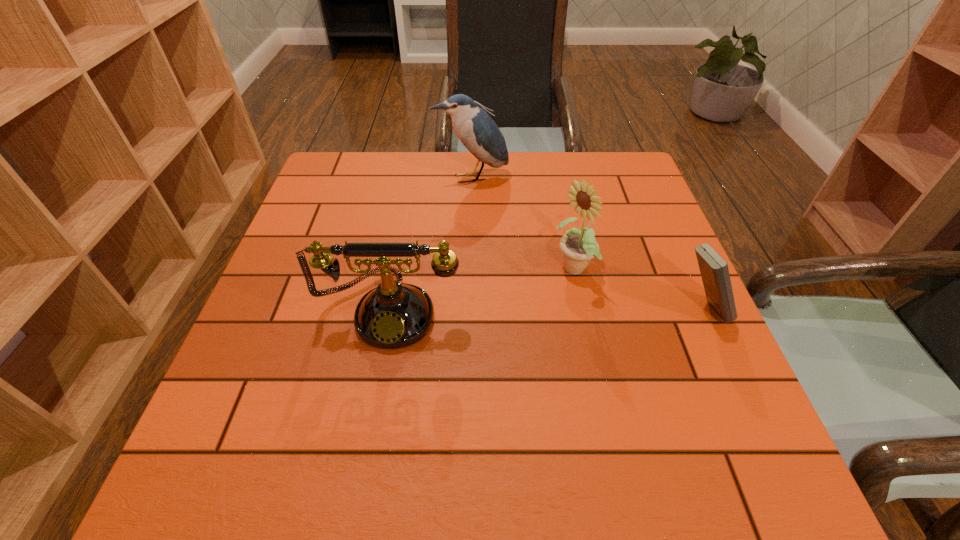
Image resolution: width=960 pixels, height=540 pixels. In order to click on free spot at the near right corner of the desktop in this screenshot , I will do `click(678, 417)`.

Where is `free space between the second object from right to left and the calculator`? This screenshot has height=540, width=960. free space between the second object from right to left and the calculator is located at coordinates (637, 290).

You are a GUI agent. You are given a task and a screenshot of the screen. Output one action in this format:
    pyautogui.click(x=<x>, y=<y>)
    Task: Click on the vacant area that lies between the calculator and the telephone
    This screenshot has width=960, height=540.
    Given the screenshot: What is the action you would take?
    pyautogui.click(x=547, y=310)

This screenshot has height=540, width=960. I want to click on free space between the third object from left to right and the calculator, so click(637, 290).

This screenshot has width=960, height=540. Find the location of `free area in between the third object from left to right and the rightmost object`. free area in between the third object from left to right and the rightmost object is located at coordinates (637, 290).

Find the location of a particular element. This screenshot has width=960, height=540. vacant region between the sunflower and the second shortest object is located at coordinates (483, 289).

At what (x,y) coordinates should I click in order to perform the action: click on unoccupied position between the second shortest object and the rightmost object. Please return your answer as a coordinate pair (x, y). This screenshot has width=960, height=540. Looking at the image, I should click on (547, 310).

Where is `vacant point located between the sunflower and the calculator`? This screenshot has height=540, width=960. vacant point located between the sunflower and the calculator is located at coordinates (637, 290).

At what (x,y) coordinates should I click in order to perform the action: click on free space between the calculator and the second shortest object. Please return your answer as a coordinate pair (x, y). The height and width of the screenshot is (540, 960). Looking at the image, I should click on (547, 310).

Where is `object that stands as the second closest to the second object from right to left`? The image size is (960, 540). object that stands as the second closest to the second object from right to left is located at coordinates (394, 315).